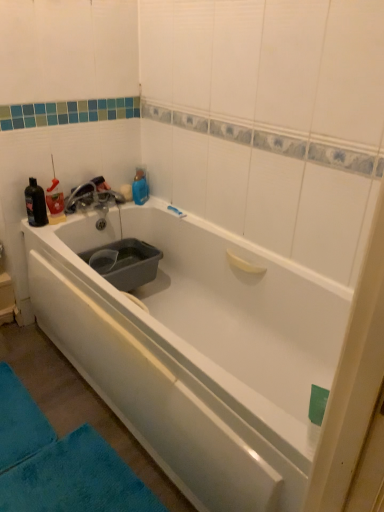
Locate an element on the screen. The height and width of the screenshot is (512, 384). free spot above blue plush bath mat at lower left, the first bath mat viewed from the right (from a real-world perspective) is located at coordinates (64, 479).